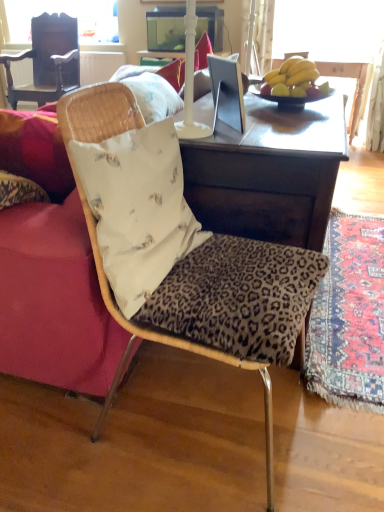
The height and width of the screenshot is (512, 384). Identify the location of vacant area situated below leopard print fabric chair at center, which ranks as the first chair in right-to-left order (from a real-world perspective). (207, 409).